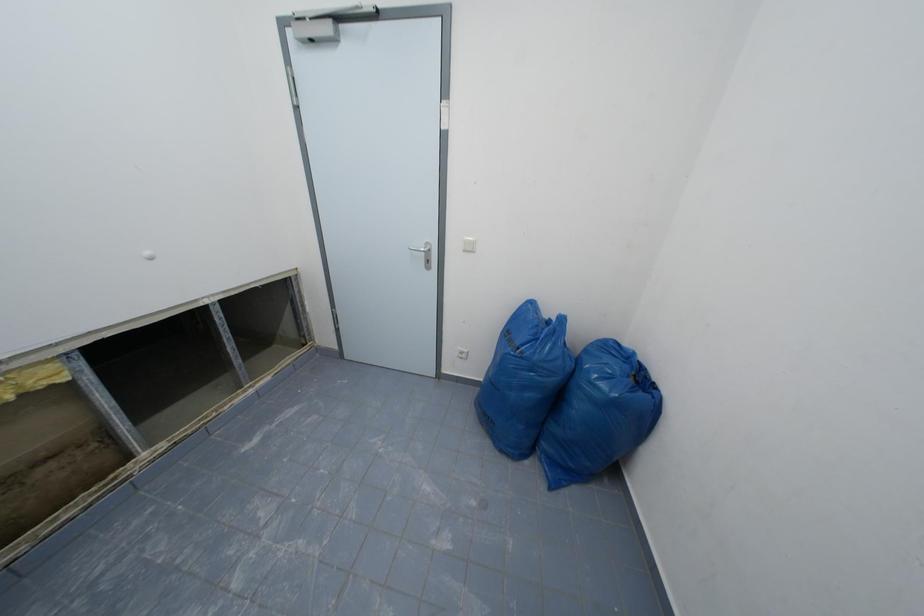
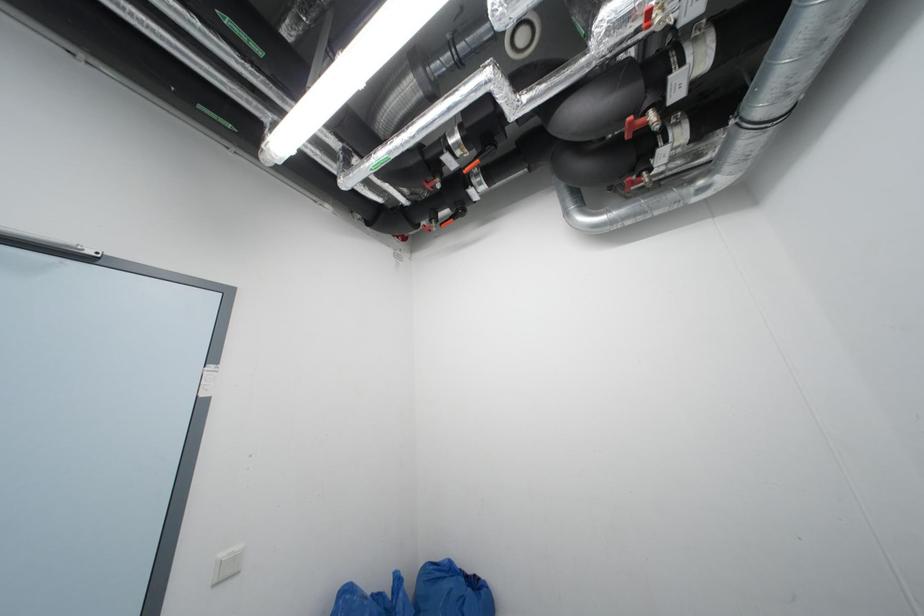
How did the camera likely rotate?

The camera rotated toward right-up.